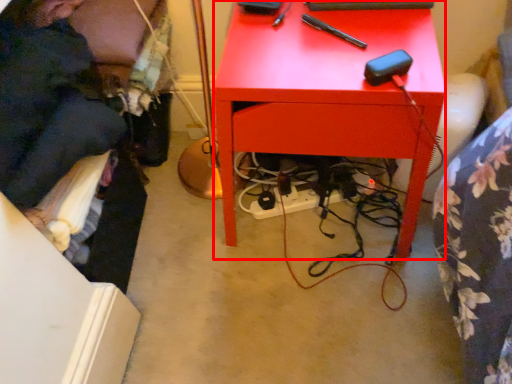
Question: From the image's perspective, where is desk (annotated by the red box) located in relation to person in the image?

Choices:
 (A) above
 (B) below

Answer: (B)